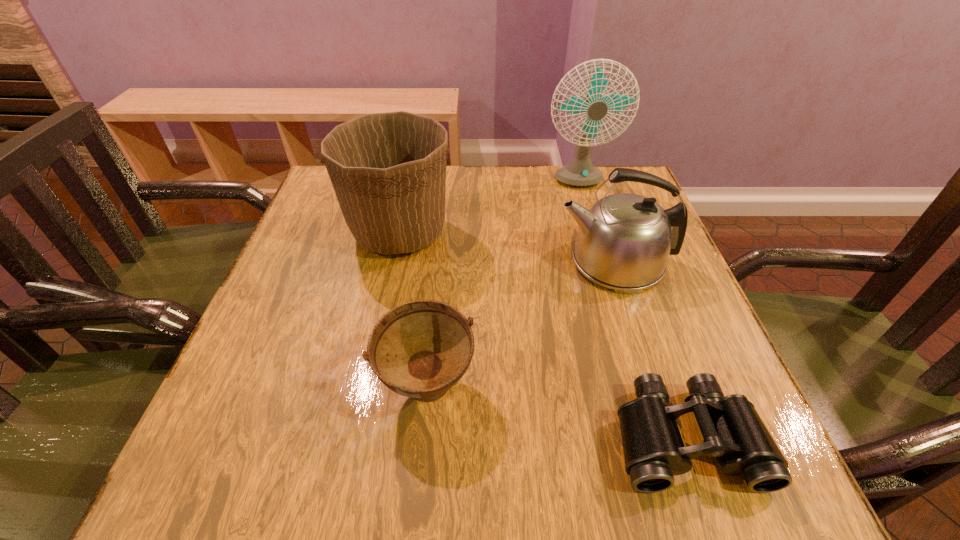
Locate an element on the screen. The image size is (960, 540). the farthest object is located at coordinates (580, 172).

The width and height of the screenshot is (960, 540). Identify the location of fan. (580, 172).

Image resolution: width=960 pixels, height=540 pixels. Find the location of `flowerpot`. flowerpot is located at coordinates (388, 170).

Identify the location of kettle. The width and height of the screenshot is (960, 540). (624, 241).

Identify the location of soup bowl. (420, 349).

You are a GUI agent. You are given a task and a screenshot of the screen. Output one action in this format:
    pyautogui.click(x=<x>, y=<y>)
    Task: Click on the shortest object
    
    Given the screenshot: What is the action you would take?
    pyautogui.click(x=733, y=432)

Image resolution: width=960 pixels, height=540 pixels. What are the coordinates of `vacant region located on the front-facing side of the fan` in the screenshot? It's located at (589, 225).

Locate an element on the screen. This screenshot has height=540, width=960. free space located on the front of the flowerpot is located at coordinates (x=365, y=400).

Locate an element on the screen. This screenshot has width=960, height=540. free space located 0.230m on the spout of the kettle is located at coordinates click(x=451, y=262).

You are a GUI agent. You are given a task and a screenshot of the screen. Output one action in this format:
    pyautogui.click(x=<x>, y=<y>)
    Task: Click on the vacant space located on the spout of the kettle
    The width and height of the screenshot is (960, 540).
    Given the screenshot: What is the action you would take?
    pyautogui.click(x=528, y=262)